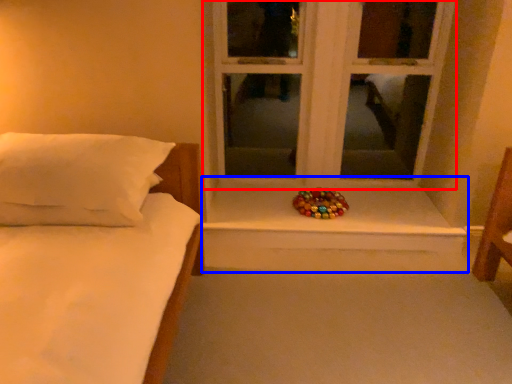
Question: Among these objects, which one is nearest to the camera, window (highlighted by a red box) or window sill (highlighted by a blue box)?

Choices:
 (A) window
 (B) window sill

Answer: (A)